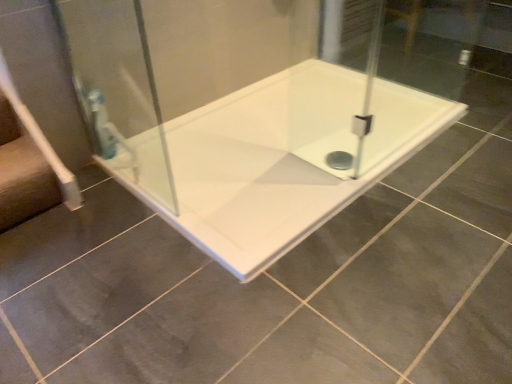
Question: Is clear glass shower door at left to the left or to the right of white glossy bathtub at center in the image?

Choices:
 (A) right
 (B) left

Answer: (B)

Question: In the image, is clear glass shower door at left positioned in front of or behind white glossy bathtub at center?

Choices:
 (A) front
 (B) behind

Answer: (A)

Question: From their relative heights in the image, would you say clear glass shower door at left is taller or shorter than white glossy bathtub at center?

Choices:
 (A) short
 (B) tall

Answer: (B)

Question: Is white glossy bathtub at center wider or thinner than clear glass shower door at left?

Choices:
 (A) wide
 (B) thin

Answer: (A)

Question: Is point (263, 145) closer or farther from the camera than point (172, 200)?

Choices:
 (A) closer
 (B) farther

Answer: (B)

Question: Would you say white glossy bathtub at center is to the left or to the right of clear glass shower door at left in the picture?

Choices:
 (A) left
 (B) right

Answer: (B)

Question: From their relative heights in the image, would you say white glossy bathtub at center is taller or shorter than clear glass shower door at left?

Choices:
 (A) short
 (B) tall

Answer: (A)